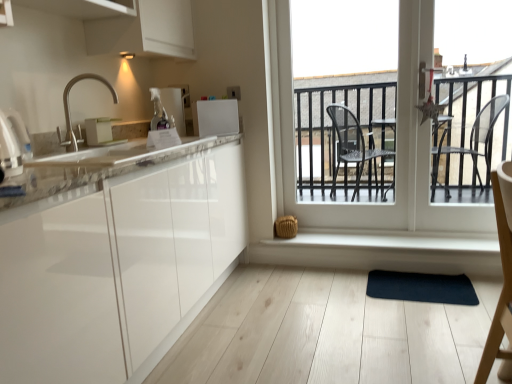
Identify the location of vacant space situated above white matte window sill at lower center (from a real-world perspective). Image resolution: width=512 pixels, height=384 pixels. (368, 236).